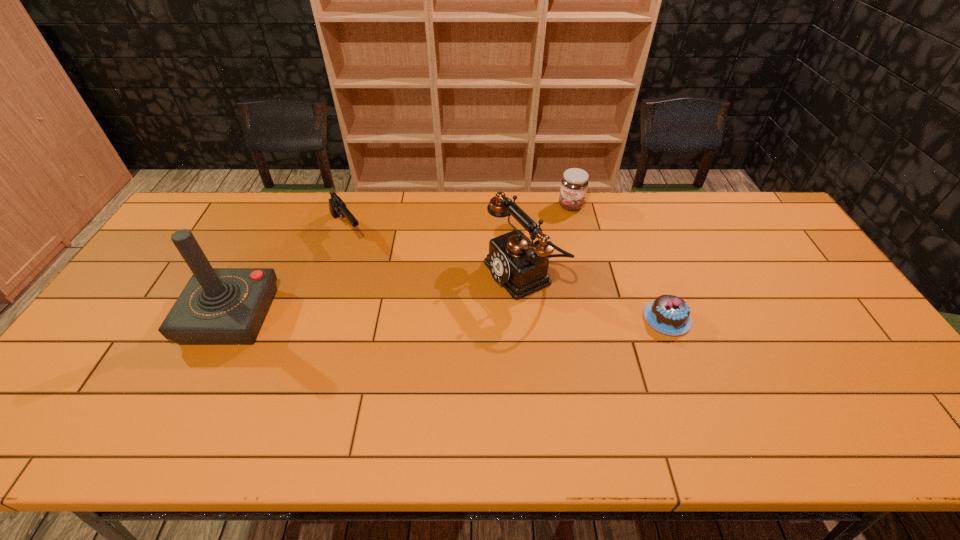
Locate an element on the screen. gun situated at the far edge is located at coordinates (337, 207).

Identify the location of jam present at the far edge. (574, 183).

Find the location of a particular element. vacant position at the far edge of the desktop is located at coordinates (263, 192).

Find the location of a particular element. This screenshot has height=540, width=960. vacant area at the near edge is located at coordinates (246, 389).

In order to click on vacant space at the left edge of the desktop in this screenshot , I will do `click(177, 293)`.

In the image, there is a desktop. Identify the location of free region at the far left corner. This screenshot has height=540, width=960. (208, 209).

Where is `free area in between the jam and the gun`? This screenshot has width=960, height=540. free area in between the jam and the gun is located at coordinates (459, 218).

You are a GUI agent. You are given a task and a screenshot of the screen. Output one action in this format:
    pyautogui.click(x=<x>, y=<y>)
    Task: Click on the vacant region between the shortest object and the jam
    
    Given the screenshot: What is the action you would take?
    pyautogui.click(x=619, y=262)

Identify the location of free spot between the second tallest object and the joystick. This screenshot has height=540, width=960. (377, 295).

Where is `free spot between the chocolate cake and the third object from left to right`? free spot between the chocolate cake and the third object from left to right is located at coordinates (595, 296).